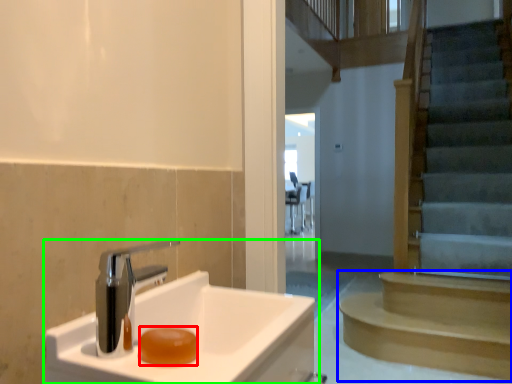
Question: Which object is positioned closest to soap (highlighted by a red box)? Select from stairs (highlighted by a blue box) and sink (highlighted by a green box).

Choices:
 (A) stairs
 (B) sink

Answer: (B)